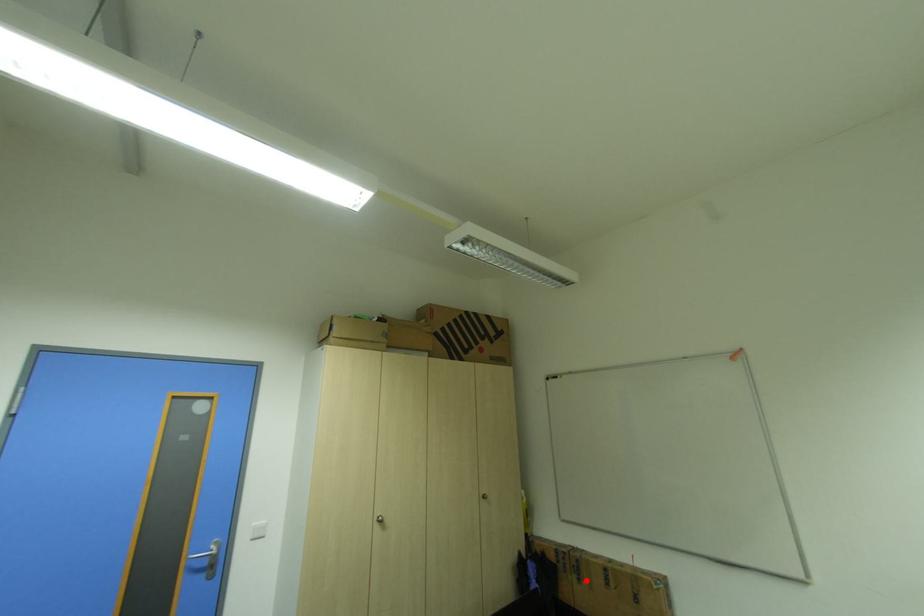
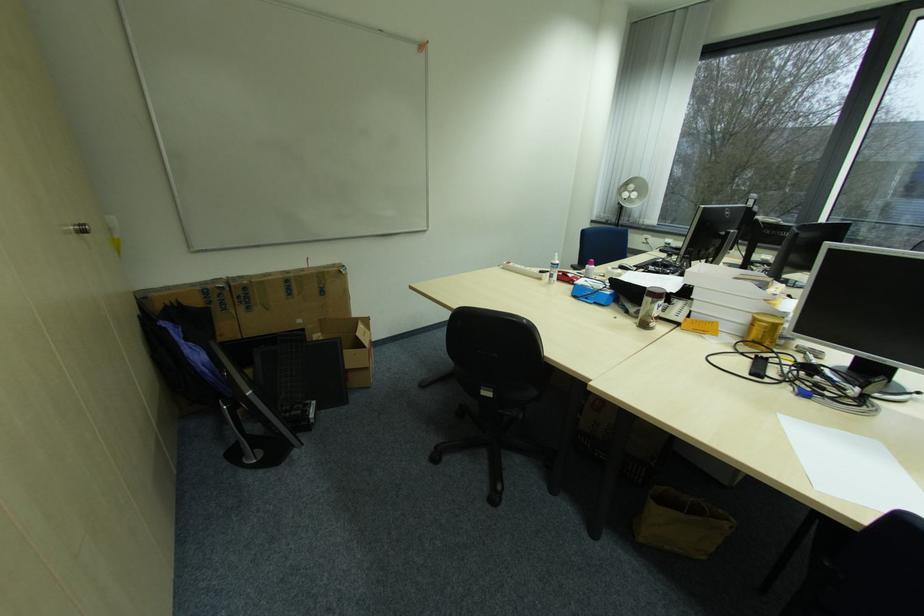
Find the pixel in the second image that matches the highlighted location in the first image.

(257, 309)